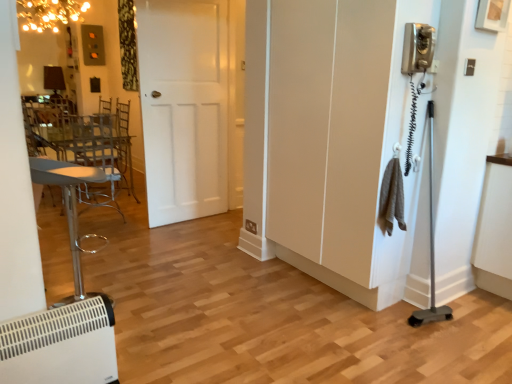
Question: Is white plastic heater at lower left located outside metallic silver swivel chair at left?

Choices:
 (A) no
 (B) yes

Answer: (B)

Question: From the image's perspective, is white plastic heater at lower left under metallic silver swivel chair at left?

Choices:
 (A) no
 (B) yes

Answer: (B)

Question: Is white plastic heater at lower left positioned far away from metallic silver swivel chair at left?

Choices:
 (A) yes
 (B) no

Answer: (B)

Question: Is white plastic heater at lower left facing away from metallic silver swivel chair at left?

Choices:
 (A) yes
 (B) no

Answer: (B)

Question: Can you confirm if white plastic heater at lower left is bigger than metallic silver swivel chair at left?

Choices:
 (A) no
 (B) yes

Answer: (A)

Question: Does white plastic heater at lower left have a smaller size compared to metallic silver swivel chair at left?

Choices:
 (A) no
 (B) yes

Answer: (B)

Question: From a real-world perspective, is white matte screen door at right located higher than white plastic heater at lower left?

Choices:
 (A) yes
 (B) no

Answer: (A)

Question: Is white matte screen door at right shorter than white plastic heater at lower left?

Choices:
 (A) no
 (B) yes

Answer: (A)

Question: Considering the relative sizes of white matte screen door at right and white plastic heater at lower left in the image provided, is white matte screen door at right bigger than white plastic heater at lower left?

Choices:
 (A) yes
 (B) no

Answer: (A)

Question: Is white matte screen door at right smaller than white plastic heater at lower left?

Choices:
 (A) no
 (B) yes

Answer: (A)

Question: Can you confirm if white matte screen door at right is positioned to the left of white plastic heater at lower left?

Choices:
 (A) no
 (B) yes

Answer: (A)

Question: Does white matte screen door at right have a greater height compared to white plastic heater at lower left?

Choices:
 (A) no
 (B) yes

Answer: (B)

Question: Is white matte door at center positioned in front of white plastic heater at lower left?

Choices:
 (A) no
 (B) yes

Answer: (A)